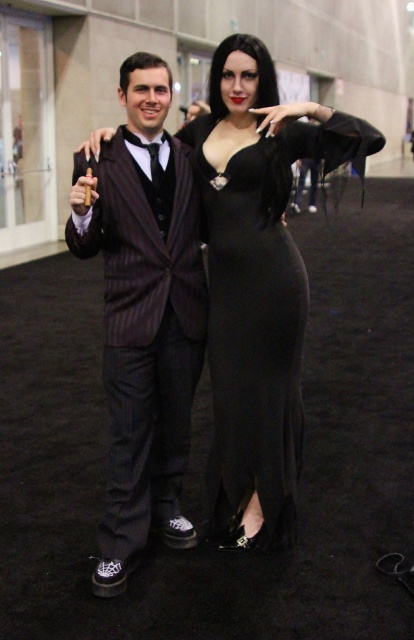
Is matte black dress at center to the right of pinstriped suit at center from the viewer's perspective?

Correct, you'll find matte black dress at center to the right of pinstriped suit at center.

Is matte black dress at center below pinstriped suit at center?

No.

Which is behind, point (291, 339) or point (103, 250)?

Positioned behind is point (291, 339).

Locate an element on the screen. The image size is (414, 640). matte black dress at center is located at coordinates [257, 280].

Is point (168, 90) farther from viewer compared to point (303, 124)?

Yes, it is behind point (303, 124).

Can you confirm if pinstriped suit at center is bigger than black satin dress at center?

Indeed, pinstriped suit at center has a larger size compared to black satin dress at center.

Which is behind, point (166, 401) or point (269, 444)?

Positioned behind is point (166, 401).

Locate an element on the screen. This screenshot has width=414, height=640. pinstriped suit at center is located at coordinates (142, 314).

Does matte black dress at center have a lesser width compared to black satin dress at center?

No.

Between matte black dress at center and black satin dress at center, which one appears on the right side from the viewer's perspective?

black satin dress at center

Where is `matte black dress at center`? Image resolution: width=414 pixels, height=640 pixels. matte black dress at center is located at coordinates (x=257, y=280).